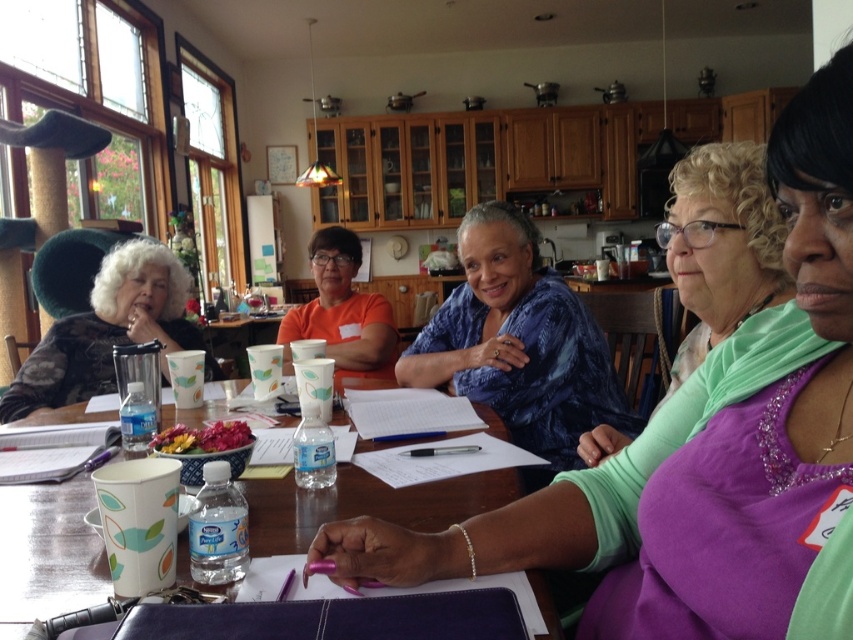
Can you confirm if wooden table at center is bigger than green matte shirt at center?

Indeed, wooden table at center has a larger size compared to green matte shirt at center.

The height and width of the screenshot is (640, 853). Describe the element at coordinates (364, 504) in the screenshot. I see `wooden table at center` at that location.

Between point (10, 566) and point (766, 228), which one is positioned in front?

Point (10, 566) is in front.

The height and width of the screenshot is (640, 853). I want to click on wooden table at center, so click(364, 504).

Can you confirm if purple satin blouse at center is thinner than orange fabric shirt at center?

Incorrect, purple satin blouse at center's width is not less than orange fabric shirt at center's.

Can you confirm if purple satin blouse at center is positioned to the left of orange fabric shirt at center?

No, purple satin blouse at center is not to the left of orange fabric shirt at center.

Who is more distant from viewer, (759, 566) or (329, 316)?

Point (329, 316)

Locate an element on the screen. This screenshot has height=640, width=853. purple satin blouse at center is located at coordinates (704, 452).

Based on the photo, can you confirm if blue patterned blouse at center is wider than green matte shirt at center?

Indeed, blue patterned blouse at center has a greater width compared to green matte shirt at center.

Can you confirm if blue patterned blouse at center is shorter than green matte shirt at center?

No, blue patterned blouse at center is not shorter than green matte shirt at center.

Locate an element on the screen. The width and height of the screenshot is (853, 640). blue patterned blouse at center is located at coordinates (519, 342).